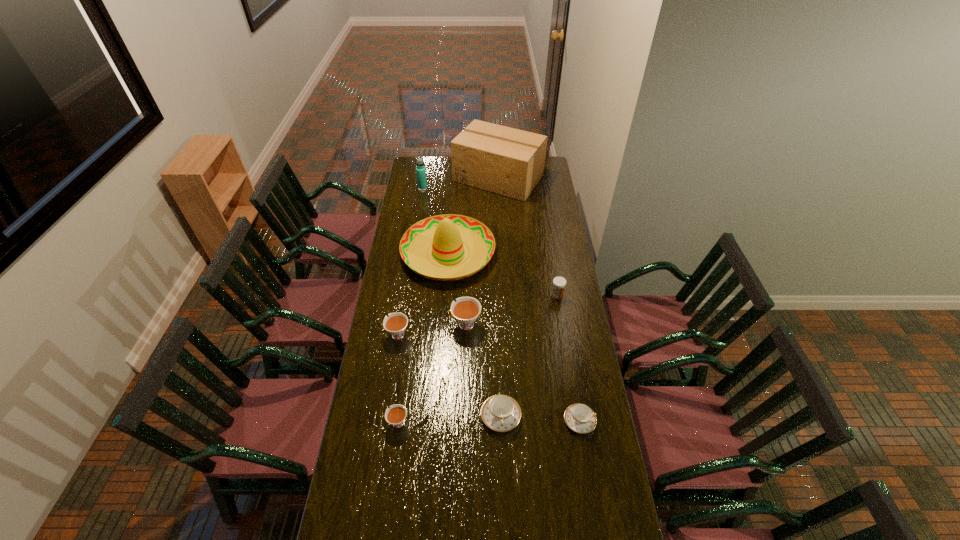
Where is `vacant space located 0.060m on the side with the handle of the left blue teacup`? This screenshot has width=960, height=540. vacant space located 0.060m on the side with the handle of the left blue teacup is located at coordinates (502, 451).

The height and width of the screenshot is (540, 960). Identify the location of vacant space located 0.100m on the side of the nearest white teacup with the handle. (358, 423).

I want to click on object that is at the far edge, so click(x=507, y=161).

The height and width of the screenshot is (540, 960). I want to click on sombrero situated at the left edge, so click(x=448, y=238).

The image size is (960, 540). I want to click on thermos bottle located at the left edge, so click(x=420, y=169).

At what (x,y) coordinates should I click in order to perform the action: click on box at the right edge. Please return your answer as a coordinate pair (x, y). This screenshot has height=540, width=960. Looking at the image, I should click on (507, 161).

This screenshot has width=960, height=540. Find the location of `medicine located in the right edge section of the desktop`. medicine located in the right edge section of the desktop is located at coordinates (559, 283).

Where is `teacup located at the right edge`? This screenshot has width=960, height=540. teacup located at the right edge is located at coordinates click(580, 418).

This screenshot has width=960, height=540. Find the location of `object that is at the far right corner`. object that is at the far right corner is located at coordinates (507, 161).

Where is `vacant area at the left edge of the desktop`? The image size is (960, 540). vacant area at the left edge of the desktop is located at coordinates (372, 386).